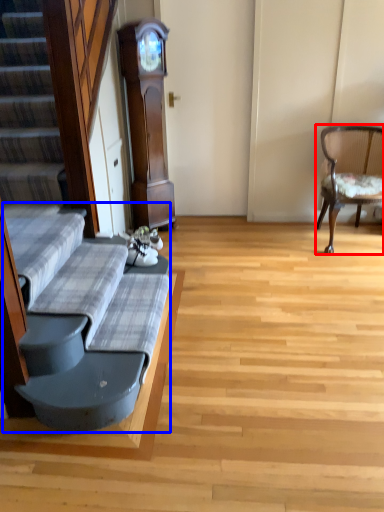
Question: Which object appears closest to the camera in this image, chair (highlighted by a red box) or couch (highlighted by a blue box)?

Choices:
 (A) chair
 (B) couch

Answer: (B)